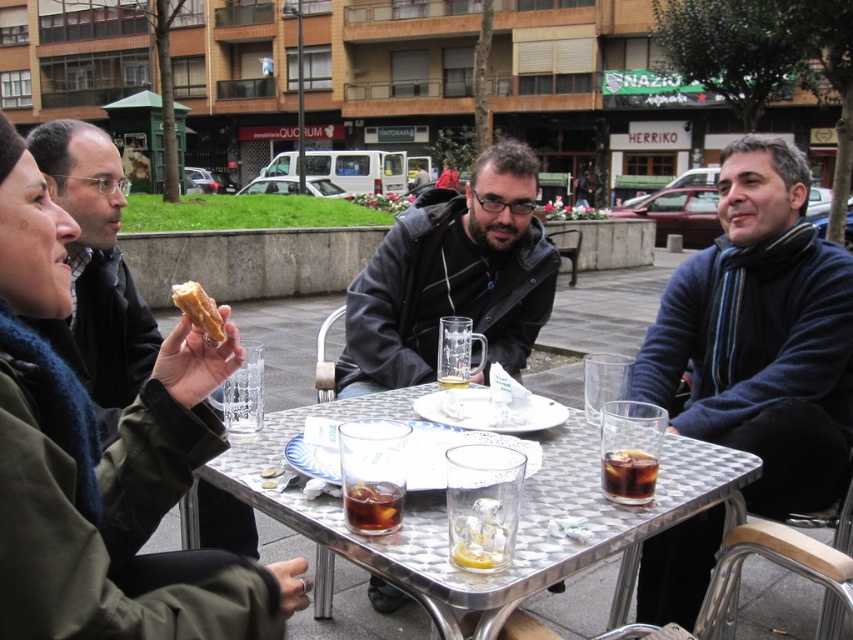
Is metallic silver table at center further to the viewer compared to dark amber liquid at center?

No, it is in front of dark amber liquid at center.

Between point (585, 464) and point (378, 497), which one is positioned in front?

Point (378, 497) is in front.

Locate an element on the screen. The width and height of the screenshot is (853, 640). metallic silver table at center is located at coordinates (519, 520).

Which of these two, metallic silver table at center or matte black jacket at left, stands shorter?

Standing shorter between the two is metallic silver table at center.

Can you confirm if metallic silver table at center is positioned to the left of matte black jacket at left?

Incorrect, metallic silver table at center is not on the left side of matte black jacket at left.

Describe the element at coordinates (519, 520) in the screenshot. I see `metallic silver table at center` at that location.

Identify the location of metallic silver table at center. The width and height of the screenshot is (853, 640). (519, 520).

Which is more to the right, dark blue sweater at right or matte black jacket at left?

dark blue sweater at right

Identify the location of dark blue sweater at right. This screenshot has width=853, height=640. (759, 333).

Find the location of `dark blue sweater at right`. dark blue sweater at right is located at coordinates (759, 333).